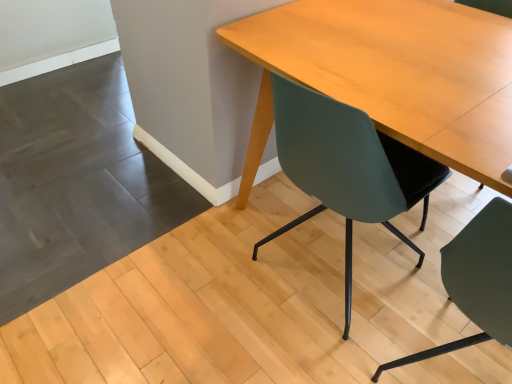
Question: Considering the positions of teal matte chair at center, positioned as the 2th chair in right-to-left order, and teal matte chair at center, acting as the second chair starting from the left, in the image, is teal matte chair at center, positioned as the 2th chair in right-to-left order, wider or thinner than teal matte chair at center, acting as the second chair starting from the left,?

Choices:
 (A) thin
 (B) wide

Answer: (A)

Question: Is teal matte chair at center, positioned as the 2th chair in right-to-left order, in front of or behind teal matte chair at center, the 1th chair in the right-to-left sequence, in the image?

Choices:
 (A) front
 (B) behind

Answer: (B)

Question: Based on their relative distances, which object is farther from the light wood table at center?

Choices:
 (A) teal matte chair at center, positioned as the 2th chair in right-to-left order
 (B) teal matte chair at center, acting as the second chair starting from the left

Answer: (B)

Question: Which is nearer to the light wood table at center?

Choices:
 (A) teal matte chair at center, the first chair from the left
 (B) teal matte chair at center, acting as the second chair starting from the left

Answer: (A)